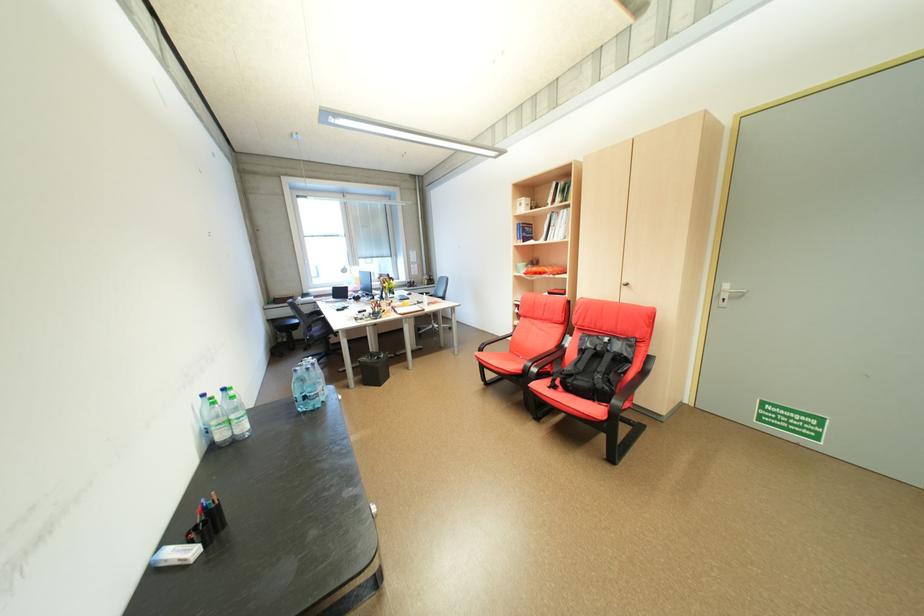
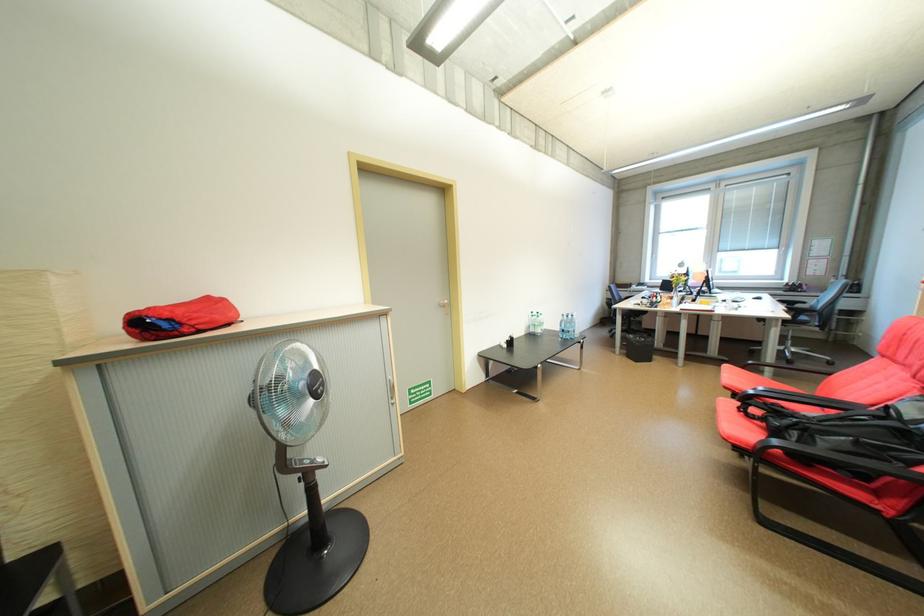
Where in the second image is the point corresponding to pixel 232 437 from the first image?

(541, 331)